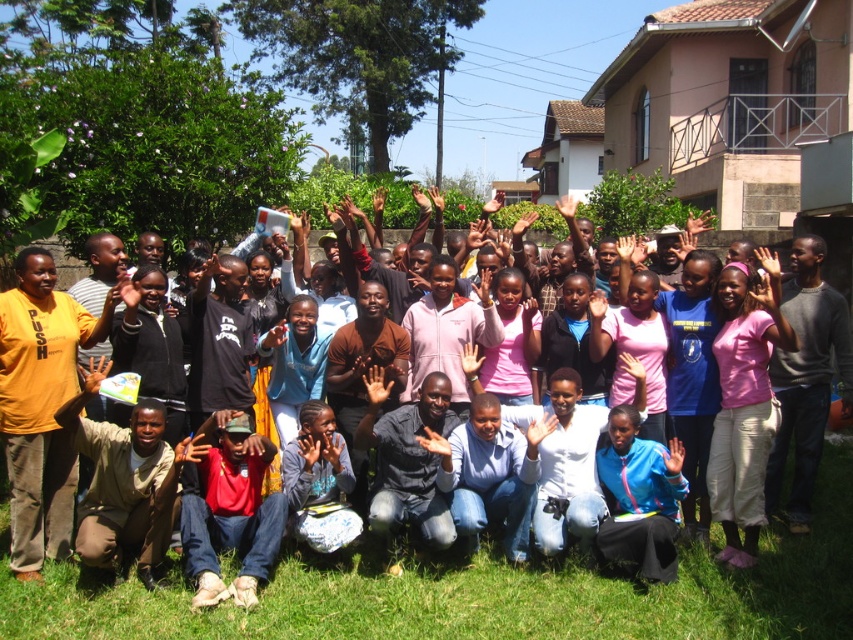
Question: Can you confirm if white matte hand at center is wider than pink fabric hand at center?

Choices:
 (A) no
 (B) yes

Answer: (B)

Question: Which object appears farthest from the camera in this image?

Choices:
 (A) matte blue hand at center
 (B) green grass at lower center

Answer: (A)

Question: Observing the image, what is the correct spatial positioning of matte yellow hand at center in reference to pink fabric hand at center?

Choices:
 (A) left
 (B) right

Answer: (A)

Question: Is matte black shirt at center smaller than pink fabric hand at center?

Choices:
 (A) no
 (B) yes

Answer: (A)

Question: Among these objects, which one is nearest to the camera?

Choices:
 (A) pink cotton shirt at center
 (B) white matte hand at center
 (C) pink matte hand at center

Answer: (A)

Question: Estimate the real-world distances between objects in this image. Which object is closer to the pink cotton shirt at center?

Choices:
 (A) green grass at lower center
 (B) pink fabric hand at center

Answer: (B)